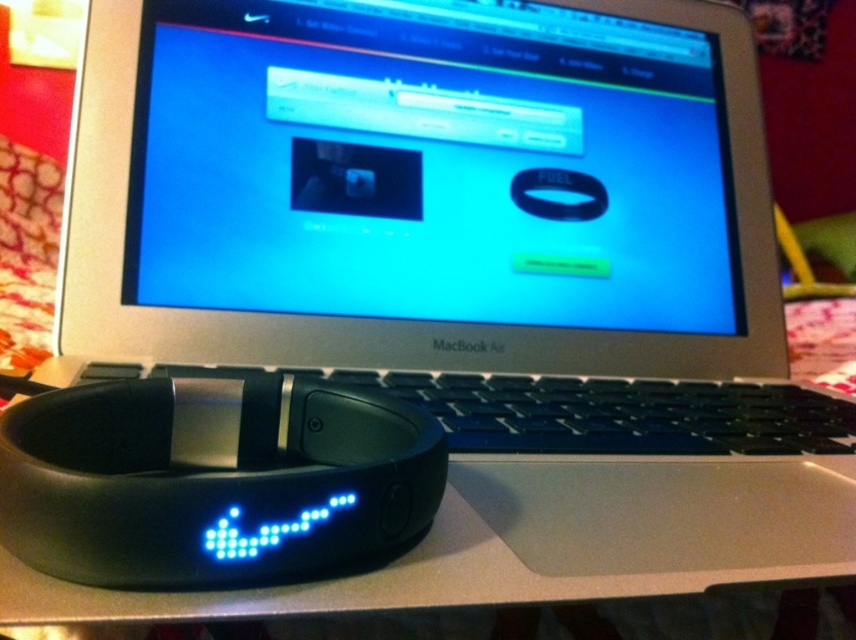
Question: Which of the following is the farthest from the observer?

Choices:
 (A) (128, 424)
 (B) (794, 512)

Answer: (B)

Question: Is black matte wristband at lower left behind black matte nike fuelband at lower left?

Choices:
 (A) no
 (B) yes

Answer: (A)

Question: Is the position of black matte wristband at lower left more distant than that of black matte nike fuelband at lower left?

Choices:
 (A) yes
 (B) no

Answer: (B)

Question: Among these objects, which one is nearest to the camera?

Choices:
 (A) black matte wristband at lower left
 (B) black matte nike fuelband at lower left

Answer: (A)

Question: Is black matte wristband at lower left to the right of black matte nike fuelband at lower left from the viewer's perspective?

Choices:
 (A) no
 (B) yes

Answer: (B)